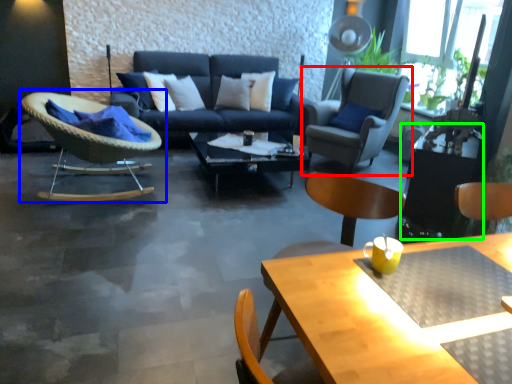
Question: Estimate the real-world distances between objects in this image. Which object is farther from chair (highlighted by a red box), chair (highlighted by a blue box) or side table (highlighted by a green box)?

Choices:
 (A) chair
 (B) side table

Answer: (A)